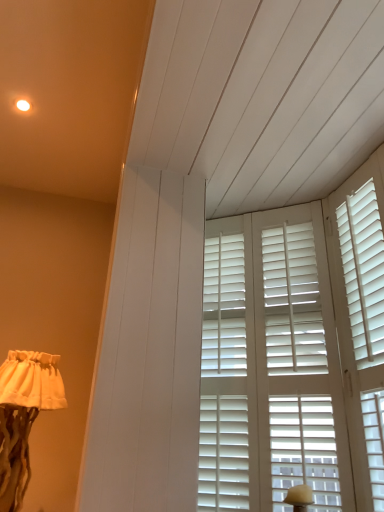
Question: Can you confirm if white fabric lampshade at lower left is shorter than white matte shutters at center?

Choices:
 (A) no
 (B) yes

Answer: (B)

Question: Is white fabric lampshade at lower left looking in the opposite direction of white matte shutters at center?

Choices:
 (A) no
 (B) yes

Answer: (A)

Question: Considering the relative sizes of white fabric lampshade at lower left and white matte shutters at center in the image provided, is white fabric lampshade at lower left taller than white matte shutters at center?

Choices:
 (A) no
 (B) yes

Answer: (A)

Question: Is the depth of white fabric lampshade at lower left less than that of white matte shutters at center?

Choices:
 (A) yes
 (B) no

Answer: (B)

Question: From a real-world perspective, is white fabric lampshade at lower left located higher than white matte shutters at center?

Choices:
 (A) no
 (B) yes

Answer: (A)

Question: Is white fabric lampshade at lower left bigger than white matte shutters at center?

Choices:
 (A) no
 (B) yes

Answer: (B)

Question: Can you confirm if white matte shutters at center is thinner than white fabric lampshade at lower left?

Choices:
 (A) yes
 (B) no

Answer: (A)

Question: From a real-world perspective, is white matte shutters at center positioned over white fabric lampshade at lower left based on gravity?

Choices:
 (A) no
 (B) yes

Answer: (B)

Question: Is white matte shutters at center to the left of white fabric lampshade at lower left from the viewer's perspective?

Choices:
 (A) yes
 (B) no

Answer: (B)

Question: Is white matte shutters at center smaller than white fabric lampshade at lower left?

Choices:
 (A) yes
 (B) no

Answer: (A)

Question: Would you say white fabric lampshade at lower left is part of white matte shutters at center's contents?

Choices:
 (A) no
 (B) yes

Answer: (A)

Question: Does white matte shutters at center lie behind white fabric lampshade at lower left?

Choices:
 (A) yes
 (B) no

Answer: (B)

Question: Is point (261, 275) closer or farther from the camera than point (29, 358)?

Choices:
 (A) closer
 (B) farther

Answer: (B)